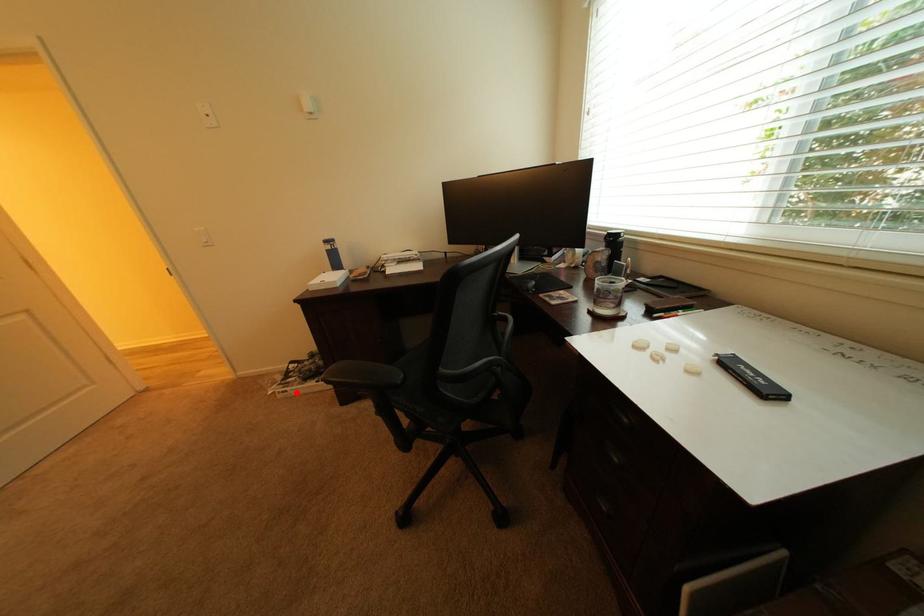
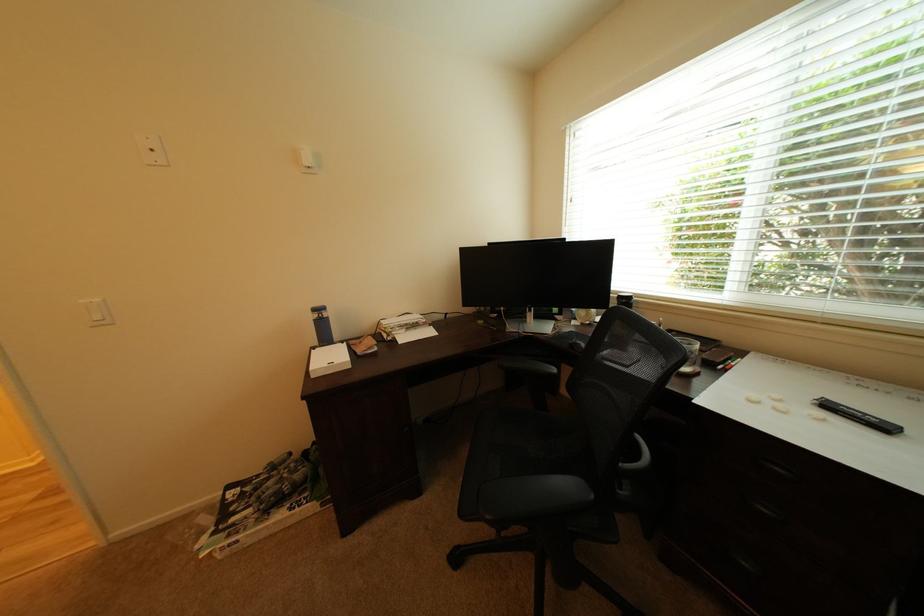
Locate, in the second image, the point that corresponds to the highlighted location in the first image.

(248, 543)